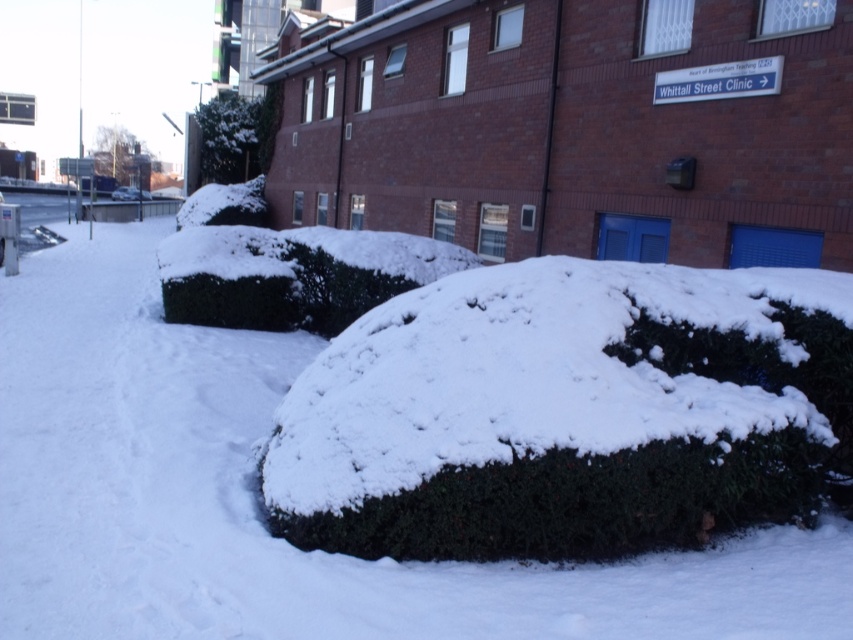
You are a delivery person trying to navigate through the snowy street. You see a green textured bush at center and a metallic silver car at center. Which object is closer to the ground?

The green textured bush at center is below the metallic silver car at center, so the green textured bush at center is closer to the ground.

You are planning to take a photo of the green textured bush at center and the metallic silver car at center in the snowy scene. Which object should you zoom in on more to ensure both are clearly visible in the frame?

Since the green textured bush at center is smaller than the metallic silver car at center, you should zoom in more on the bush to ensure both are clearly visible in the frame.